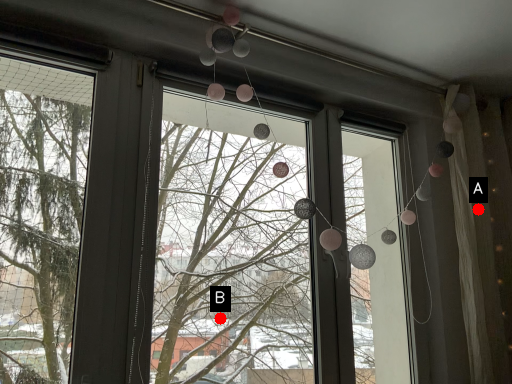
Question: Two points are circled on the image, labeled by A and B beside each circle. Among these points, which one is nearest to the camera?

Choices:
 (A) A is closer
 (B) B is closer

Answer: (A)